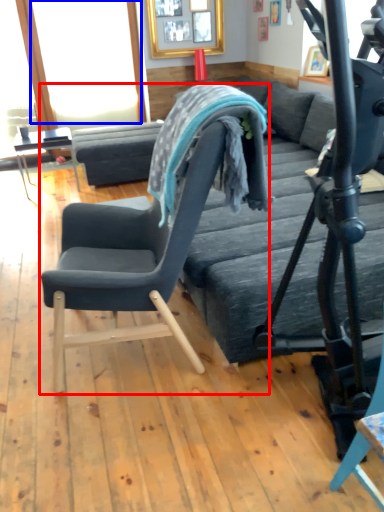
Question: Which object appears farthest to the camera in this image, chair (highlighted by a red box) or window screen (highlighted by a blue box)?

Choices:
 (A) chair
 (B) window screen

Answer: (B)